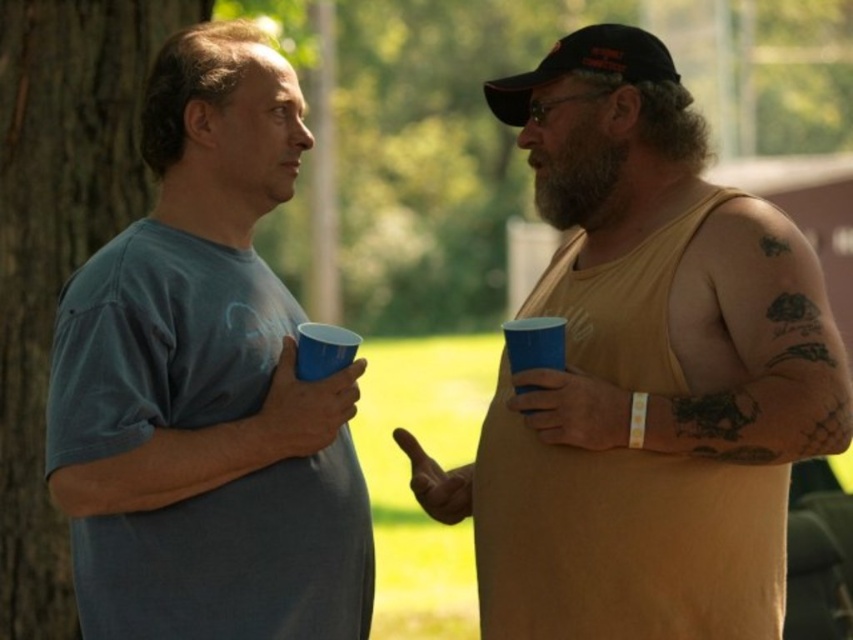
From the picture: You are a photographer trying to capture a clear photo of the matte yellow tank top at right and the blue plastic cup at right. Since both are at the same location, which one should you focus on first to ensure it appears sharp in the photo?

The matte yellow tank top at right is in front of the blue plastic cup at right, so you should focus on the matte yellow tank top at right first to ensure it appears sharp in the photo.

You are standing in a park and see a brown rough bark at left. If you want to touch it, which direction should you face?

You should face towards the left to touch the brown rough bark at left.